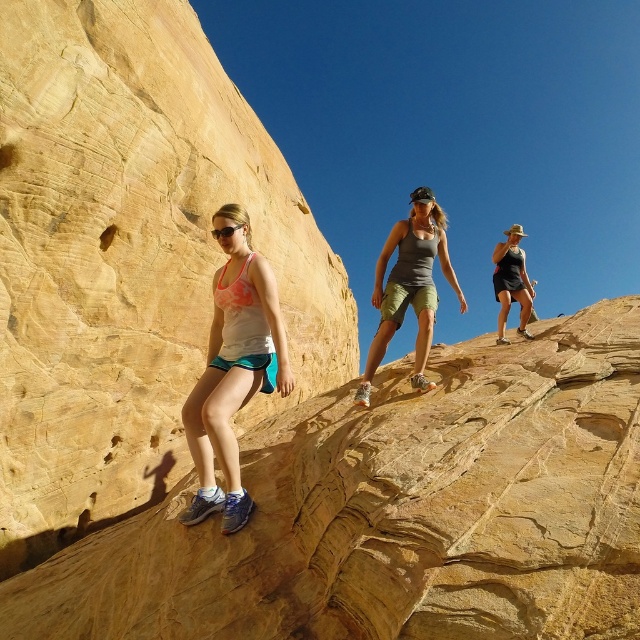
You are standing at the point labeled point (184, 198) on a steep, rocky incline. If you want to take a photo of the hikers below you, how far will you need to move the camera to capture them all in the frame?

The camera is 51.10 meters away from the point labeled point (184, 198). To capture all the hikers in the frame, you would need to adjust the camera position or zoom level to ensure they are within the 51.10 meters distance range from the point.

You are a photographer trying to capture the yellow sandstone rock face at left and the matte black tank top at upper right in the same frame. Based on their sizes, which object should you focus on first to ensure both are in the frame?

The yellow sandstone rock face at left is larger in size than the matte black tank top at upper right, so you should focus on the yellow sandstone rock face at left first to ensure both fit within the frame.